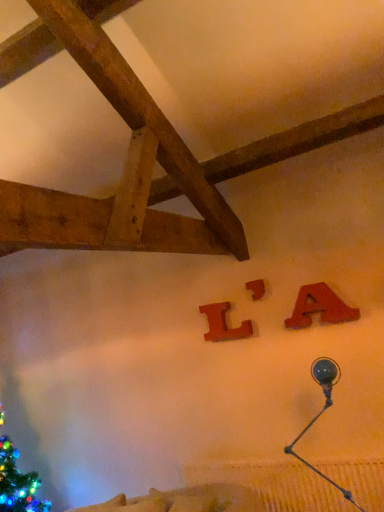
Question: Can you confirm if matte wood letter at center, the second alphabet in the left-to-right sequence, is positioned to the right of metallic blue lamp at upper right?

Choices:
 (A) no
 (B) yes

Answer: (A)

Question: Does matte wood letter at center, acting as the 2th alphabet starting from the front, have a greater width compared to metallic blue lamp at upper right?

Choices:
 (A) yes
 (B) no

Answer: (B)

Question: Is matte wood letter at center, the second alphabet in the left-to-right sequence, not within metallic blue lamp at upper right?

Choices:
 (A) no
 (B) yes

Answer: (B)

Question: From a real-world perspective, is matte wood letter at center, which ranks as the second alphabet in right-to-left order, over metallic blue lamp at upper right?

Choices:
 (A) yes
 (B) no

Answer: (A)

Question: From the image's perspective, does matte wood letter at center, acting as the 2th alphabet starting from the front, appear higher than metallic blue lamp at upper right?

Choices:
 (A) no
 (B) yes

Answer: (B)

Question: In terms of size, does wooden letter l at center, the first alphabet from the left, appear bigger or smaller than matte wood letter a at upper right, which is the first alphabet from front to back?

Choices:
 (A) small
 (B) big

Answer: (A)

Question: Is wooden letter l at center, the first alphabet from the left, situated inside matte wood letter a at upper right, which is the first alphabet from front to back, or outside?

Choices:
 (A) outside
 (B) inside

Answer: (A)

Question: Considering their positions, is wooden letter l at center, acting as the 3th alphabet starting from the front, located in front of or behind matte wood letter a at upper right, arranged as the third alphabet when viewed from the back?

Choices:
 (A) front
 (B) behind

Answer: (B)

Question: Is wooden letter l at center, acting as the 3th alphabet starting from the front, to the left or to the right of matte wood letter a at upper right, the first alphabet viewed from the right, in the image?

Choices:
 (A) left
 (B) right

Answer: (A)

Question: From a real-world perspective, is wooden letter l at center, the first alphabet from the left, physically located above or below metallic blue lamp at upper right?

Choices:
 (A) below
 (B) above

Answer: (B)

Question: Is point (244, 329) closer or farther from the camera than point (319, 358)?

Choices:
 (A) farther
 (B) closer

Answer: (A)

Question: Which is correct: wooden letter l at center, the first alphabet from the left, is inside metallic blue lamp at upper right, or outside of it?

Choices:
 (A) inside
 (B) outside

Answer: (B)

Question: Is wooden letter l at center, the 1th alphabet positioned from the back, in front of or behind metallic blue lamp at upper right in the image?

Choices:
 (A) behind
 (B) front

Answer: (A)

Question: From a real-world perspective, is matte wood letter a at upper right, arranged as the third alphabet when viewed from the back, above or below metallic blue lamp at upper right?

Choices:
 (A) below
 (B) above

Answer: (B)

Question: In the image, is matte wood letter a at upper right, the first alphabet viewed from the right, positioned in front of or behind metallic blue lamp at upper right?

Choices:
 (A) behind
 (B) front

Answer: (A)